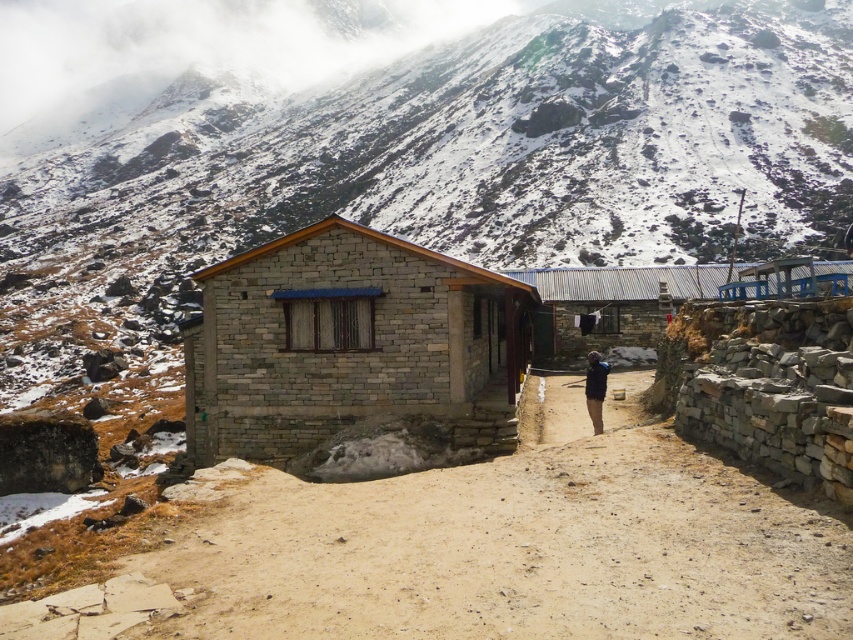
You are a hiker trying to reach the rustic stone building. You see the brown dirt path at center and the dark blue jacket at center. Which object is smaller in size?

The brown dirt path at center has a smaller size compared to dark blue jacket at center.

You are standing at the entrance of the rustic stone building and want to see if the dark blue jacket at center is visible from your position. Since the brown dirt path at center is in between you and the jacket, does the path block the view of the jacket?

The brown dirt path at center has a lesser height compared to dark blue jacket at center, so the path is not tall enough to block the view of the jacket. Therefore, the dark blue jacket at center should be visible from the building entrance.

You are a hiker planning to walk along the brown dirt track at center towards the rustic stone hut at center. Considering the track is narrower than the hut, will you have enough space to walk comfortably on the track while approaching the hut?

The brown dirt track at center is thinner than rustic stone hut at center, so the track may be too narrow for comfortable walking. You might need to proceed carefully to avoid obstacles on either side of the path.